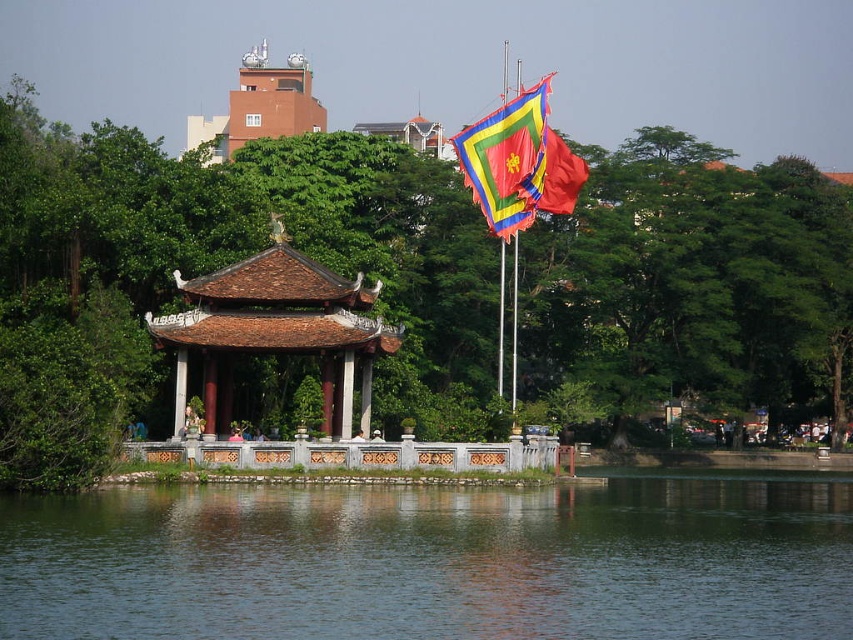
Looking at this image, who is positioned more to the right, green smooth water at center or matte orange temple at upper center?

From the viewer's perspective, green smooth water at center appears more on the right side.

How far apart are green smooth water at center and matte orange temple at upper center?

A distance of 80.00 meters exists between green smooth water at center and matte orange temple at upper center.

Does point (619, 515) come farther from viewer compared to point (306, 76)?

No, (619, 515) is in front of (306, 76).

Where is `green smooth water at center`? Image resolution: width=853 pixels, height=640 pixels. green smooth water at center is located at coordinates (433, 561).

Does green smooth water at center have a lesser width compared to red fabric flag at upper center?

In fact, green smooth water at center might be wider than red fabric flag at upper center.

Who is more distant from viewer, (x=229, y=516) or (x=560, y=163)?

Point (x=560, y=163)

Between point (370, 531) and point (555, 147), which one is positioned behind?

The point (555, 147) is more distant.

The width and height of the screenshot is (853, 640). I want to click on green smooth water at center, so click(433, 561).

Which of these two, matte orange temple at upper center or red fabric flag at upper center, stands shorter?

red fabric flag at upper center is shorter.

Describe the element at coordinates (259, 106) in the screenshot. The width and height of the screenshot is (853, 640). I see `matte orange temple at upper center` at that location.

Does point (253, 61) come farther from viewer compared to point (537, 189)?

Yes, point (253, 61) is farther from viewer.

Image resolution: width=853 pixels, height=640 pixels. What are the coordinates of `matte orange temple at upper center` in the screenshot? It's located at (259, 106).